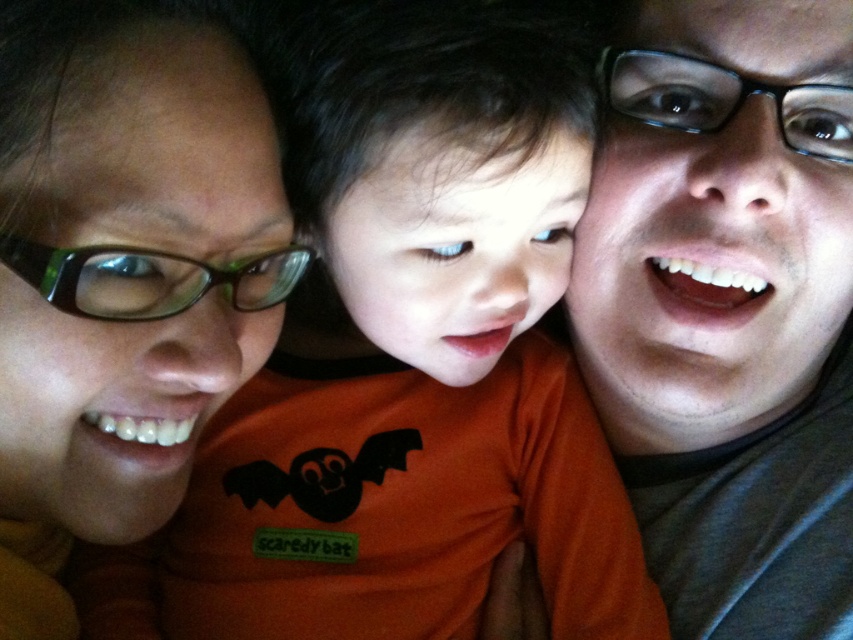
Question: Among these objects, which one is farthest from the camera?

Choices:
 (A) orange matte shirt at center
 (B) matte orange shirt at center

Answer: (A)

Question: Is orange matte shirt at center positioned in front of matte orange shirt at center?

Choices:
 (A) no
 (B) yes

Answer: (A)

Question: Is orange matte shirt at center below matte orange shirt at center?

Choices:
 (A) yes
 (B) no

Answer: (A)

Question: Is orange matte shirt at center closer to camera compared to matte orange shirt at center?

Choices:
 (A) no
 (B) yes

Answer: (A)